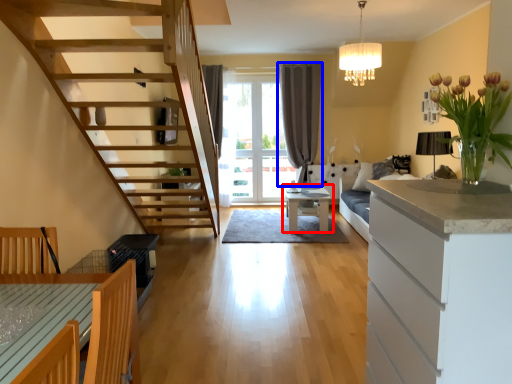
Question: Among these objects, which one is farthest to the camera, table (highlighted by a red box) or curtain (highlighted by a blue box)?

Choices:
 (A) table
 (B) curtain

Answer: (B)